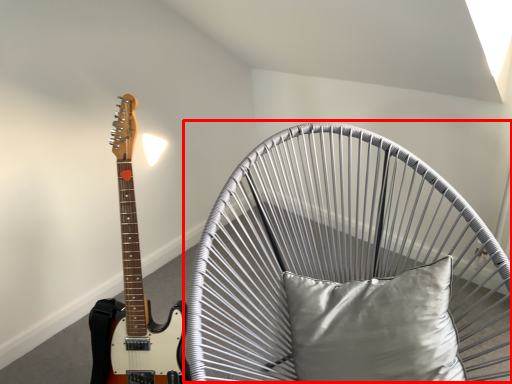
Question: Observing the image, what is the correct spatial positioning of swivel chair (annotated by the red box) in reference to pillow?

Choices:
 (A) left
 (B) right

Answer: (A)